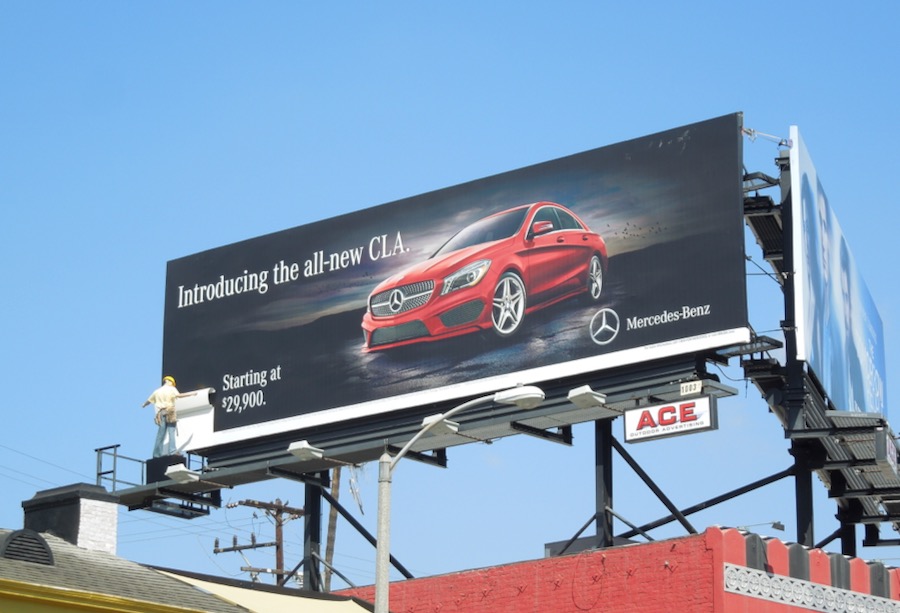
Where is `chimney`? The image size is (900, 613). chimney is located at coordinates (68, 512).